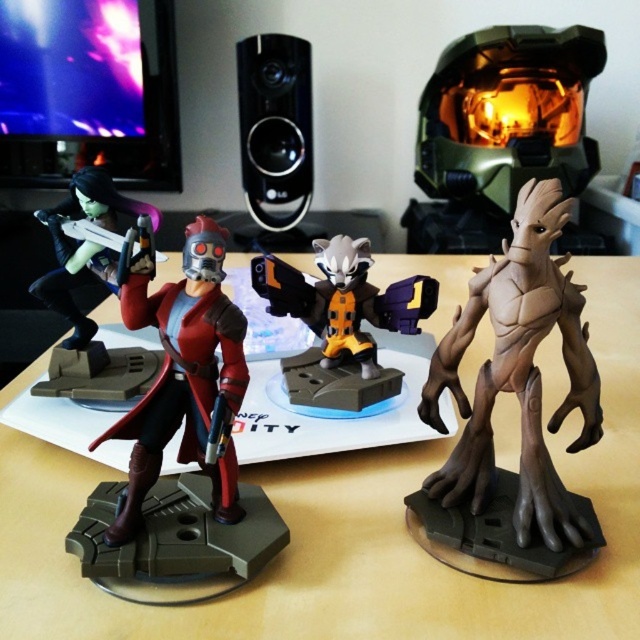
Can you confirm if brown matte tree-like figure at right is positioned to the right of matte black figure at left?

Correct, you'll find brown matte tree-like figure at right to the right of matte black figure at left.

Measure the distance between brown matte tree-like figure at right and camera.

brown matte tree-like figure at right is 63.95 centimeters from camera.

Which is behind, point (490, 408) or point (93, 176)?

Positioned behind is point (93, 176).

Identify the location of brown matte tree-like figure at right. The height and width of the screenshot is (640, 640). (518, 372).

Is light brown wood table at center bigger than matte black figure at left?

Yes, light brown wood table at center is bigger than matte black figure at left.

Is light brown wood table at center closer to the viewer compared to matte black figure at left?

That is False.

Is point (353, 464) positioned behind point (68, 259)?

Yes.

Find the location of `light brown wood table at center`. light brown wood table at center is located at coordinates (353, 531).

Which is in front, point (140, 317) or point (368, 390)?

Point (140, 317) is more forward.

Who is lower down, matte red plastic figure at center or glossy plastic figure at center?

Positioned lower is matte red plastic figure at center.

This screenshot has width=640, height=640. I want to click on matte red plastic figure at center, so pyautogui.click(x=182, y=374).